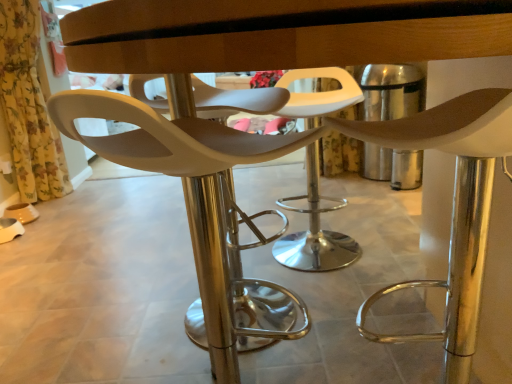
Question: Is matte white chair at center, marked as the first chair in a right-to-left arrangement, looking in the opposite direction of matte white chair at center, acting as the second chair starting from the right?

Choices:
 (A) yes
 (B) no

Answer: (B)

Question: Would you say matte white chair at center, which is the 1th chair from left to right, is part of matte white chair at center, marked as the first chair in a right-to-left arrangement,'s contents?

Choices:
 (A) yes
 (B) no

Answer: (B)

Question: Is matte white chair at center, marked as the first chair in a right-to-left arrangement, bigger than matte white chair at center, acting as the second chair starting from the right?

Choices:
 (A) yes
 (B) no

Answer: (A)

Question: Is matte white chair at center, marked as the first chair in a right-to-left arrangement, positioned before matte white chair at center, acting as the second chair starting from the right?

Choices:
 (A) yes
 (B) no

Answer: (A)

Question: From a real-world perspective, is matte white chair at center, the second chair in the left-to-right sequence, under matte white chair at center, acting as the second chair starting from the right?

Choices:
 (A) yes
 (B) no

Answer: (B)

Question: Does matte white chair at center, marked as the first chair in a right-to-left arrangement, have a greater width compared to matte white chair at center, which is the 1th chair from left to right?

Choices:
 (A) yes
 (B) no

Answer: (A)

Question: Is matte white chair at center, acting as the second chair starting from the right, facing towards yellow floral fabric at left?

Choices:
 (A) yes
 (B) no

Answer: (B)

Question: Considering the relative sizes of matte white chair at center, which is the 1th chair from left to right, and yellow floral fabric at left in the image provided, is matte white chair at center, which is the 1th chair from left to right, bigger than yellow floral fabric at left?

Choices:
 (A) yes
 (B) no

Answer: (B)

Question: Is matte white chair at center, which is the 1th chair from left to right, positioned beyond the bounds of yellow floral fabric at left?

Choices:
 (A) yes
 (B) no

Answer: (A)

Question: Considering the relative sizes of matte white chair at center, acting as the second chair starting from the right, and yellow floral fabric at left in the image provided, is matte white chair at center, acting as the second chair starting from the right, shorter than yellow floral fabric at left?

Choices:
 (A) no
 (B) yes

Answer: (B)

Question: Considering the relative sizes of matte white chair at center, acting as the second chair starting from the right, and yellow floral fabric at left in the image provided, is matte white chair at center, acting as the second chair starting from the right, wider than yellow floral fabric at left?

Choices:
 (A) yes
 (B) no

Answer: (A)

Question: Is matte white chair at center, which is the 1th chair from left to right, placed right next to yellow floral fabric at left?

Choices:
 (A) no
 (B) yes

Answer: (A)

Question: Is yellow floral fabric at left smaller than matte white chair at center, marked as the first chair in a right-to-left arrangement?

Choices:
 (A) yes
 (B) no

Answer: (B)